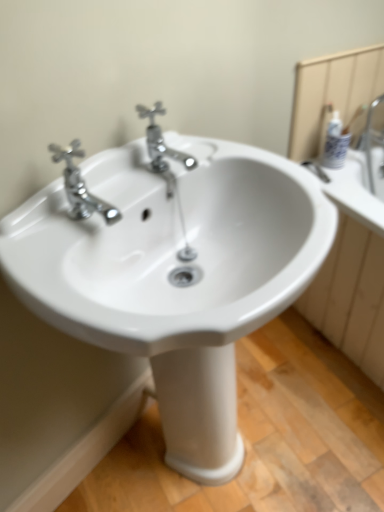
Question: Does chrome/metallic faucet at center, the 2th tap positioned from the left, touch chrome metallic faucet at upper left, the first tap from the left?

Choices:
 (A) yes
 (B) no

Answer: (B)

Question: Is chrome/metallic faucet at center, positioned as the 1th tap in right-to-left order, at the right side of chrome metallic faucet at upper left, the first tap from the left?

Choices:
 (A) yes
 (B) no

Answer: (A)

Question: Can you confirm if chrome/metallic faucet at center, positioned as the 1th tap in right-to-left order, is shorter than chrome metallic faucet at upper left, the 2th tap when ordered from right to left?

Choices:
 (A) no
 (B) yes

Answer: (A)

Question: Is chrome/metallic faucet at center, positioned as the 1th tap in right-to-left order, taller than chrome metallic faucet at upper left, the 2th tap when ordered from right to left?

Choices:
 (A) yes
 (B) no

Answer: (A)

Question: Is chrome/metallic faucet at center, the 2th tap positioned from the left, positioned before chrome metallic faucet at upper left, the first tap from the left?

Choices:
 (A) yes
 (B) no

Answer: (B)

Question: Is point (163, 170) closer or farther from the camera than point (236, 332)?

Choices:
 (A) closer
 (B) farther

Answer: (B)

Question: Would you say chrome/metallic faucet at center, the 2th tap positioned from the left, is inside or outside white glossy sink at center?

Choices:
 (A) inside
 (B) outside

Answer: (A)

Question: From their relative heights in the image, would you say chrome/metallic faucet at center, the 2th tap positioned from the left, is taller or shorter than white glossy sink at center?

Choices:
 (A) tall
 (B) short

Answer: (B)

Question: From the image's perspective, is chrome/metallic faucet at center, the 2th tap positioned from the left, positioned above or below white glossy sink at center?

Choices:
 (A) above
 (B) below

Answer: (A)

Question: In terms of height, does white glossy mirror at upper right look taller or shorter compared to chrome metallic faucet at upper left, the first tap from the left?

Choices:
 (A) tall
 (B) short

Answer: (A)

Question: Does point (375, 91) appear closer or farther from the camera than point (92, 206)?

Choices:
 (A) closer
 (B) farther

Answer: (B)

Question: In the image, is white glossy mirror at upper right positioned in front of or behind chrome metallic faucet at upper left, the first tap from the left?

Choices:
 (A) behind
 (B) front

Answer: (A)

Question: Would you say white glossy mirror at upper right is to the left or to the right of chrome metallic faucet at upper left, the 2th tap when ordered from right to left, in the picture?

Choices:
 (A) left
 (B) right

Answer: (B)

Question: In the image, is white glossy sink at center positioned in front of or behind chrome metallic faucet at upper left, the 2th tap when ordered from right to left?

Choices:
 (A) front
 (B) behind

Answer: (A)

Question: Is white glossy sink at center bigger or smaller than chrome metallic faucet at upper left, the first tap from the left?

Choices:
 (A) big
 (B) small

Answer: (A)